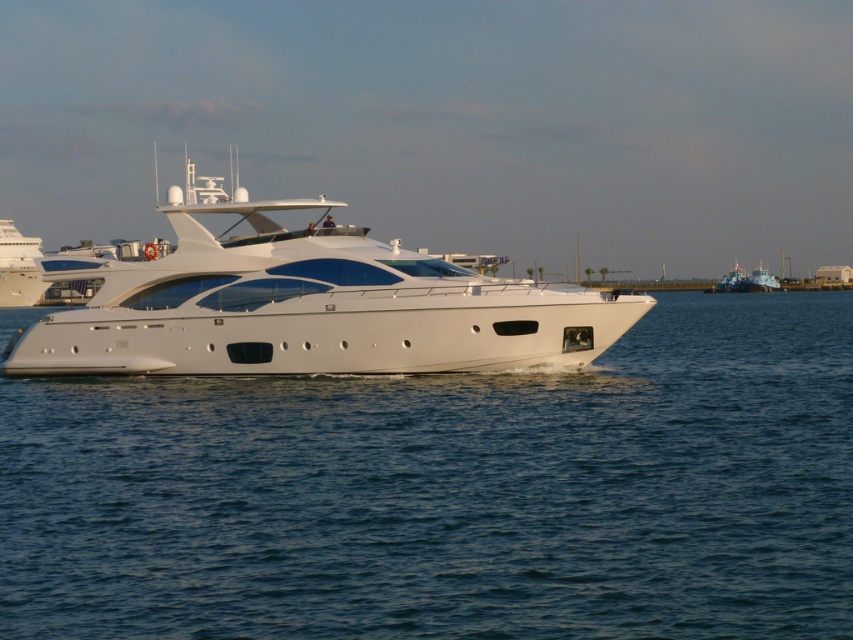
Can you confirm if white glossy yacht at center is smaller than metallic gray boat at right?

Actually, white glossy yacht at center might be larger than metallic gray boat at right.

Locate an element on the screen. white glossy yacht at center is located at coordinates (305, 305).

Measure the distance between white glossy yacht at center and camera.

The distance of white glossy yacht at center from camera is 36.25 meters.

Find the location of a particular element. The image size is (853, 640). white glossy yacht at center is located at coordinates (305, 305).

Is white glossy yacht at center thinner than blue matte boat at right?

No.

Does white glossy yacht at center have a lesser height compared to blue matte boat at right?

In fact, white glossy yacht at center may be taller than blue matte boat at right.

Between point (450, 356) and point (759, 284), which one is positioned in front?

Point (450, 356)

I want to click on white glossy yacht at center, so click(x=305, y=305).

Which is in front, point (22, 262) or point (762, 280)?

Positioned in front is point (22, 262).

This screenshot has height=640, width=853. Find the location of `white glossy yacht at left`. white glossy yacht at left is located at coordinates (18, 268).